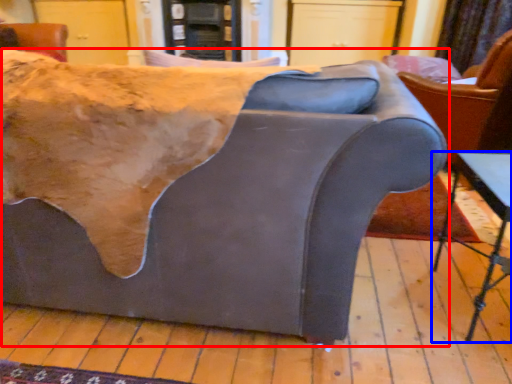
Question: Among these objects, which one is nearest to the camera, studio couch (highlighted by a red box) or table (highlighted by a blue box)?

Choices:
 (A) studio couch
 (B) table

Answer: (A)